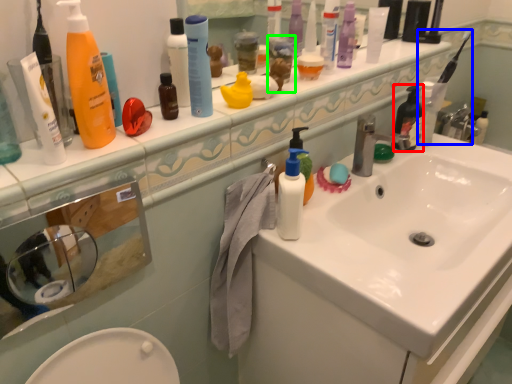
Question: Based on their relative distances, which object is nearer to toiletry (highlighted by a red box)? Choose from toothbrush (highlighted by a blue box) and toiletry (highlighted by a green box).

Choices:
 (A) toothbrush
 (B) toiletry

Answer: (A)